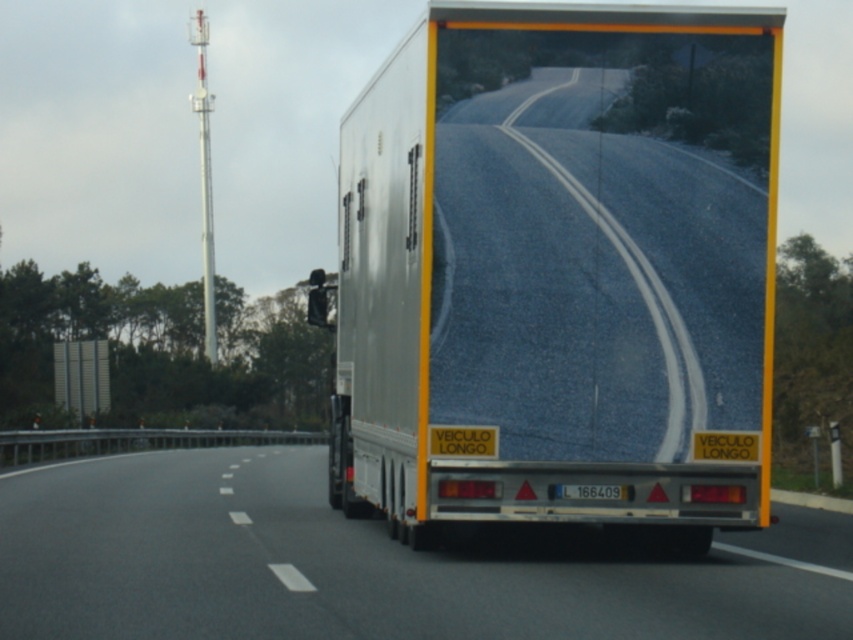
Question: From the image, what is the correct spatial relationship of silver metallic trailer truck at center in relation to asphalt road at center?

Choices:
 (A) left
 (B) right

Answer: (B)

Question: Which point is closer to the camera taking this photo?

Choices:
 (A) (712, 74)
 (B) (801, 605)

Answer: (B)

Question: Considering the relative positions of silver metallic trailer truck at center and asphalt road at center in the image provided, where is silver metallic trailer truck at center located with respect to asphalt road at center?

Choices:
 (A) right
 (B) left

Answer: (A)

Question: Can you confirm if silver metallic trailer truck at center is thinner than asphalt road at center?

Choices:
 (A) yes
 (B) no

Answer: (A)

Question: Which point is farther to the camera?

Choices:
 (A) asphalt road at center
 (B) silver metallic trailer truck at center

Answer: (B)

Question: Which point is closer to the camera?

Choices:
 (A) silver metallic trailer truck at center
 (B) asphalt road at center

Answer: (B)